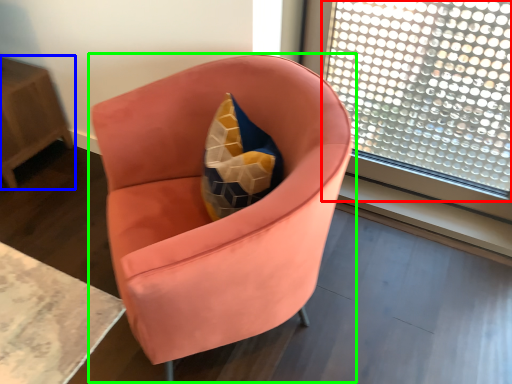
Question: Considering the real-world distances, which object is closest to window (highlighted by a red box)? table (highlighted by a blue box) or chair (highlighted by a green box).

Choices:
 (A) table
 (B) chair

Answer: (B)